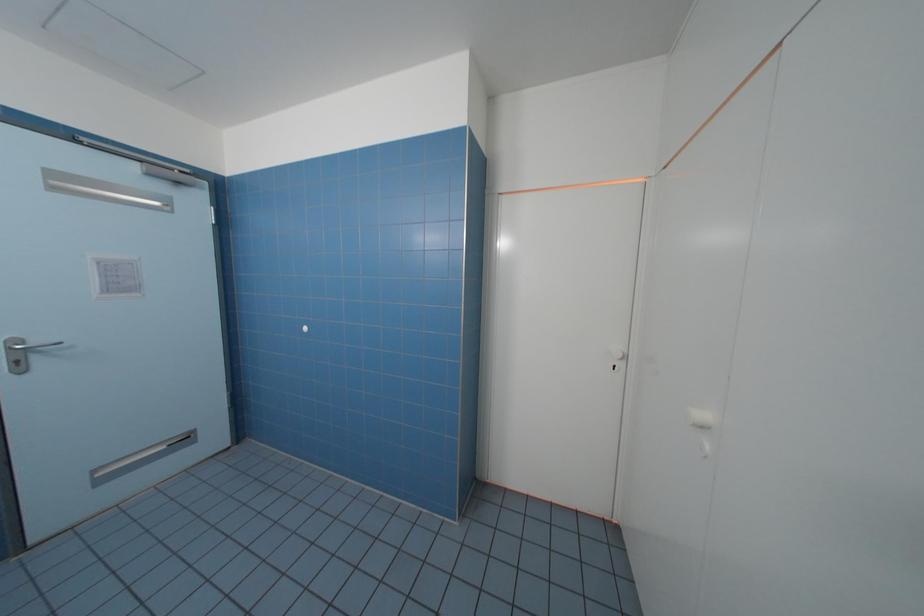
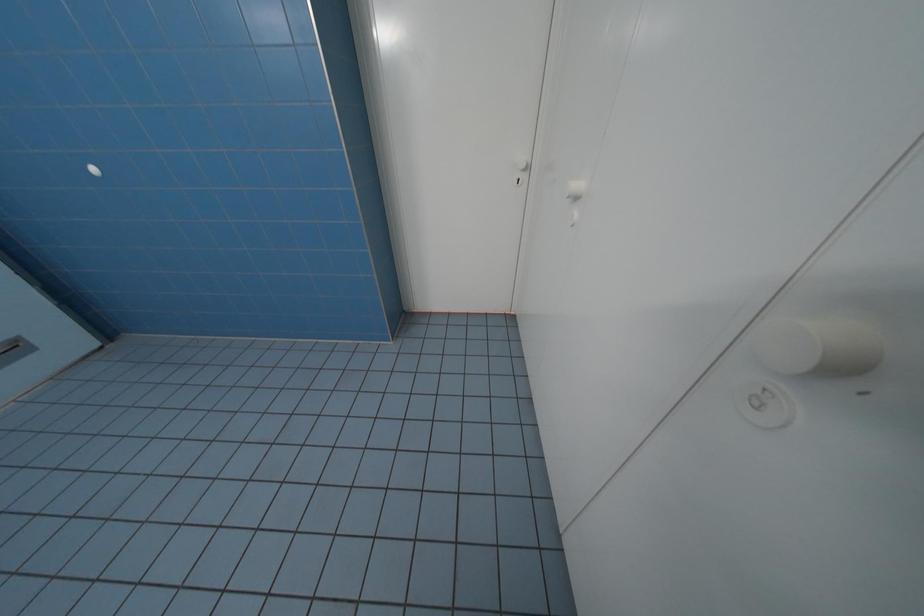
Based on the continuous images, in which direction is the camera rotating?

The camera's rotation is toward right-down.